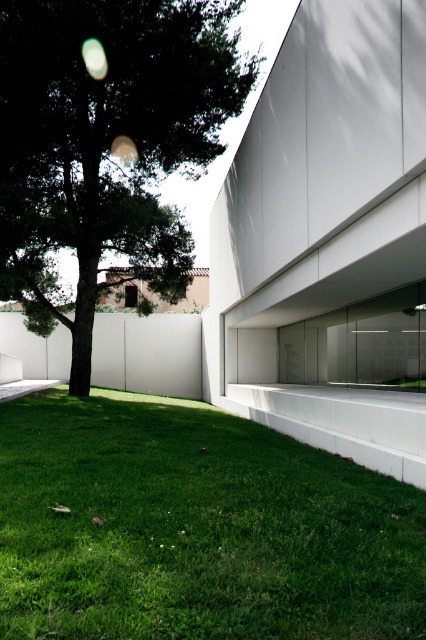
You are standing in front of the modern building and want to walk towards the green leafy tree at left. Which direction should you move relative to the green grass at lower left?

The green grass at lower left is to the right of the green leafy tree at left. Therefore, to reach the green leafy tree at left, you should move to the left relative to the green grass at lower left.

You are planning to place a picnic blanket on the green grass at lower left. Considering the space available, will the blanket fit comfortably if it requires an area wider than the green leafy tree at left?

The green grass at lower left has a width less than the green leafy tree at left, so the picnic blanket requiring a wider area than the tree would not fit comfortably on the green grass at lower left.

You are standing in front of the modern building and want to walk towards the green leafy tree at left. Which direction should you walk to avoid stepping on the green grass at lower left?

The green grass at lower left is in front of the green leafy tree at left, so to avoid stepping on the green grass at lower left, you should walk around to the right side of the green leafy tree at left.